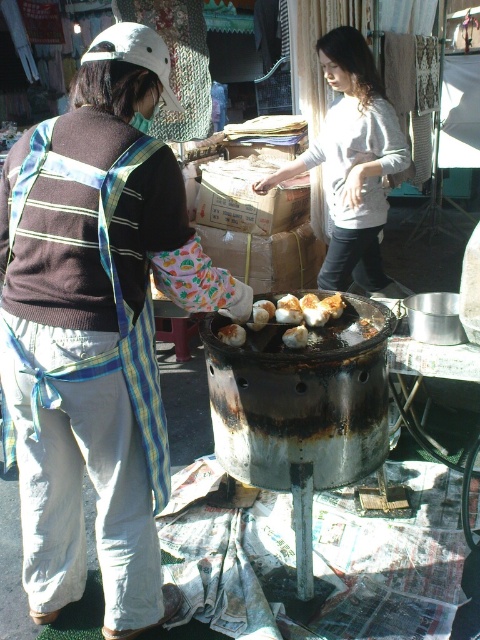
Which of these two, light gray sweater at center or brown matte bread at center, stands taller?

Standing taller between the two is light gray sweater at center.

Is the position of light gray sweater at center more distant than that of brown matte bread at center?

That is True.

Who is more forward, (349,97) or (303,339)?

Point (303,339) is more forward.

The height and width of the screenshot is (640, 480). In order to click on light gray sweater at center in this screenshot , I will do `click(352, 163)`.

Is point (363, 80) positioned before point (242, 332)?

No.

The height and width of the screenshot is (640, 480). Describe the element at coordinates (352, 163) in the screenshot. I see `light gray sweater at center` at that location.

You are a GUI agent. You are given a task and a screenshot of the screen. Output one action in this format:
    pyautogui.click(x=<x>, y=<y>)
    Task: Click on the light gray sweater at center
    Image resolution: width=480 pixels, height=640 pixels.
    Given the screenshot: What is the action you would take?
    pyautogui.click(x=352, y=163)

Can you confirm if rusty metal grill at center is positioned above brown matte dumplings at center?

Actually, rusty metal grill at center is below brown matte dumplings at center.

From the picture: Is rusty metal grill at center to the left of brown matte dumplings at center from the viewer's perspective?

Correct, you'll find rusty metal grill at center to the left of brown matte dumplings at center.

Which is in front, point (367, 368) or point (336, 305)?

Point (367, 368)

Identify the location of rusty metal grill at center. The height and width of the screenshot is (640, 480). (301, 410).